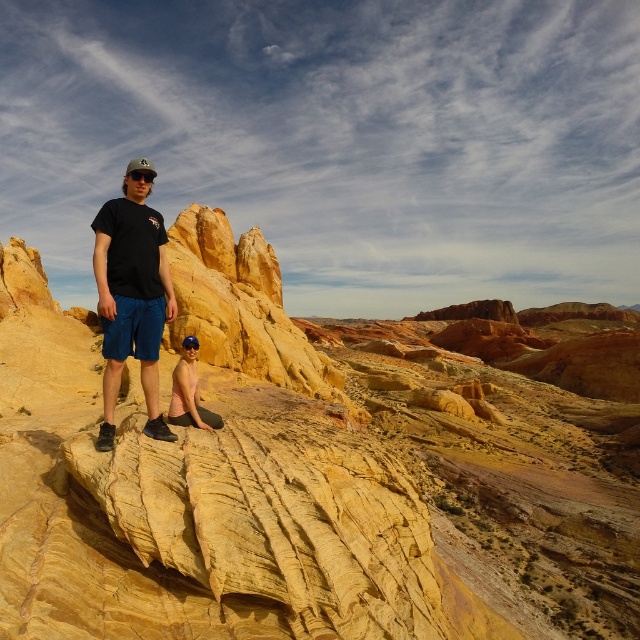
This screenshot has height=640, width=640. Describe the element at coordinates (131, 296) in the screenshot. I see `matte black t-shirt at center` at that location.

Is matte black t-shirt at center behind pink matte skin at lower center?

No, matte black t-shirt at center is closer to the viewer.

Does point (136, 192) come closer to viewer compared to point (172, 403)?

That is True.

Where is `matte black t-shirt at center`? This screenshot has width=640, height=640. matte black t-shirt at center is located at coordinates (131, 296).

Find the location of a particular element. The image size is (640, 640). yellow sandstone rock at center is located at coordinates (314, 470).

Is yellow sandstone rock at center thinner than matte black t-shirt at center?

Incorrect, yellow sandstone rock at center's width is not less than matte black t-shirt at center's.

Which is in front, point (349, 605) or point (108, 296)?

Point (349, 605) is more forward.

At what (x,y) coordinates should I click in order to perform the action: click on yellow sandstone rock at center. Please return your answer as a coordinate pair (x, y). Image resolution: width=640 pixels, height=640 pixels. Looking at the image, I should click on (314, 470).

Does point (396, 484) lie behind point (195, 422)?

Yes, it is behind point (195, 422).

Which is behind, point (532, 605) or point (186, 380)?

The point (532, 605) is more distant.

Locate an element on the screen. This screenshot has height=640, width=640. yellow sandstone rock at center is located at coordinates (314, 470).